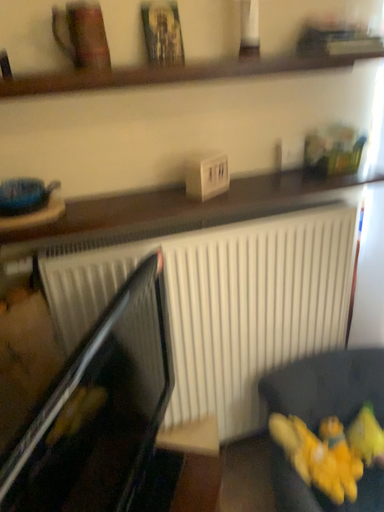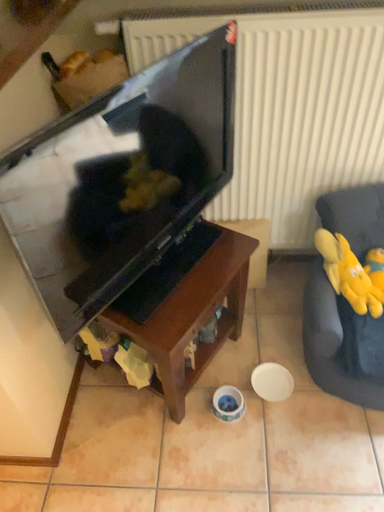
Question: Which way did the camera rotate in the video?

Choices:
 (A) rotated upward
 (B) rotated downward

Answer: (B)